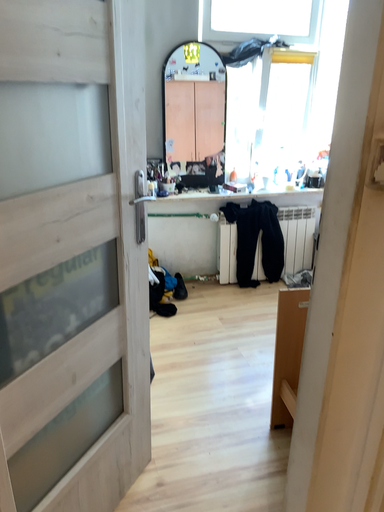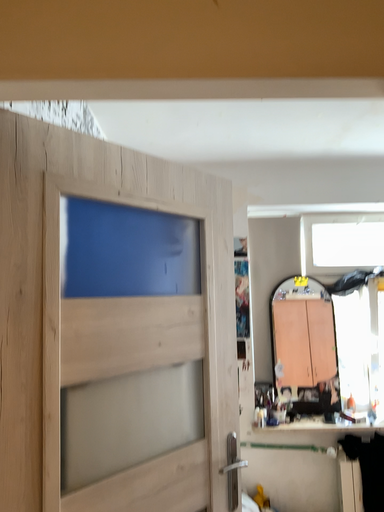
Question: How did the camera likely rotate when shooting the video?

Choices:
 (A) rotated right
 (B) rotated left

Answer: (B)